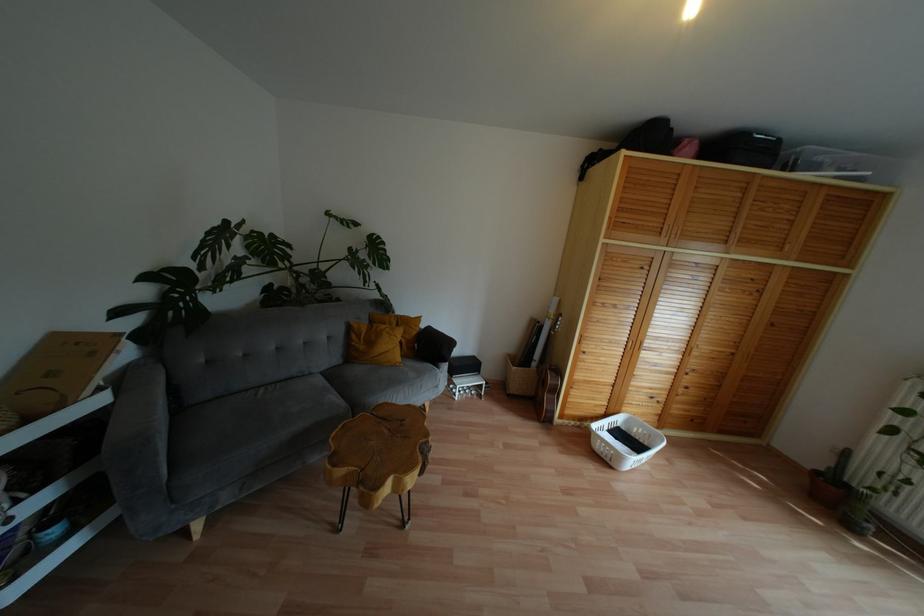
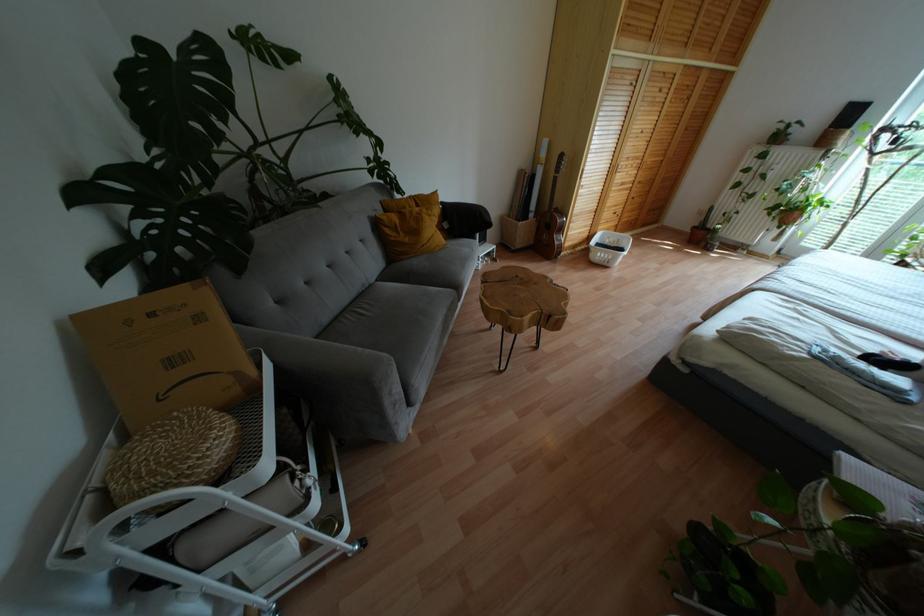
Where in the second image is the point corresponding to pixel 91 354 from the first image?

(199, 317)